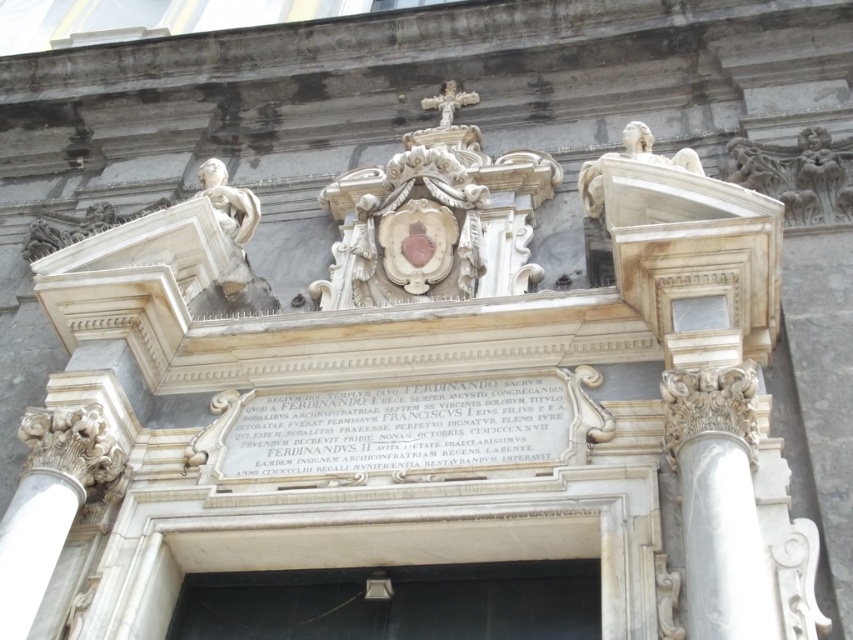
Question: Estimate the real-world distances between objects in this image. Which object is closer to the white marble plaque at center?

Choices:
 (A) black matte door at center
 (B) white marble column at right

Answer: (A)

Question: Does black matte door at center have a lesser width compared to white marble plaque at center?

Choices:
 (A) no
 (B) yes

Answer: (A)

Question: From the image, what is the correct spatial relationship of black matte door at center in relation to white marble column at right?

Choices:
 (A) left
 (B) right

Answer: (A)

Question: Which object is the farthest from the black matte door at center?

Choices:
 (A) white marble plaque at center
 (B) white marble column at right

Answer: (B)

Question: Can you confirm if white marble plaque at center is bigger than white marble column at right?

Choices:
 (A) no
 (B) yes

Answer: (B)

Question: Which point is closer to the camera taking this photo?

Choices:
 (A) (717, 580)
 (B) (321, 600)
 (C) (316, 417)

Answer: (A)